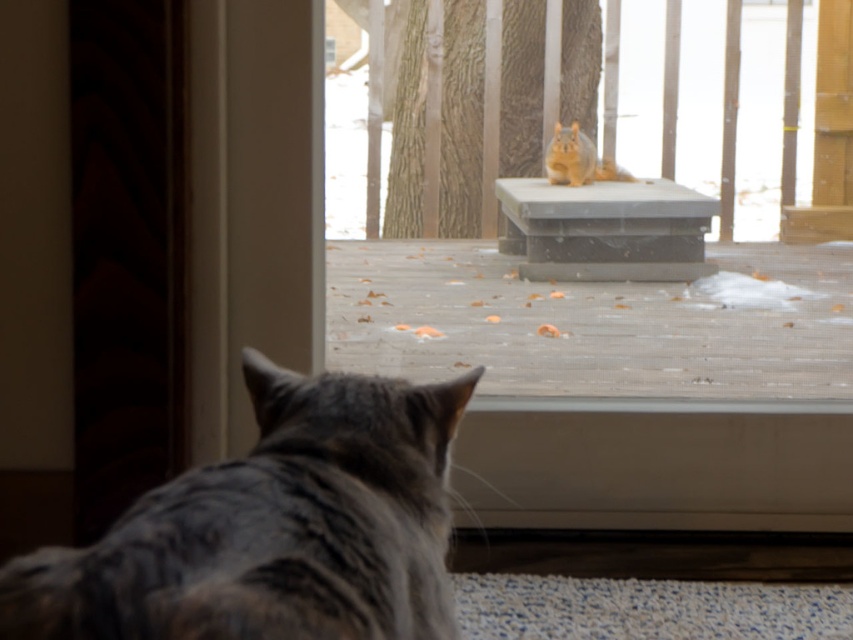
In the scene shown: Is gray fur cat at lower left positioned behind blonde fur squirrel at upper center?

No, it is not.

Which is more to the right, gray fur cat at lower left or blonde fur squirrel at upper center?

From the viewer's perspective, blonde fur squirrel at upper center appears more on the right side.

Locate an element on the screen. Image resolution: width=853 pixels, height=640 pixels. gray fur cat at lower left is located at coordinates (273, 528).